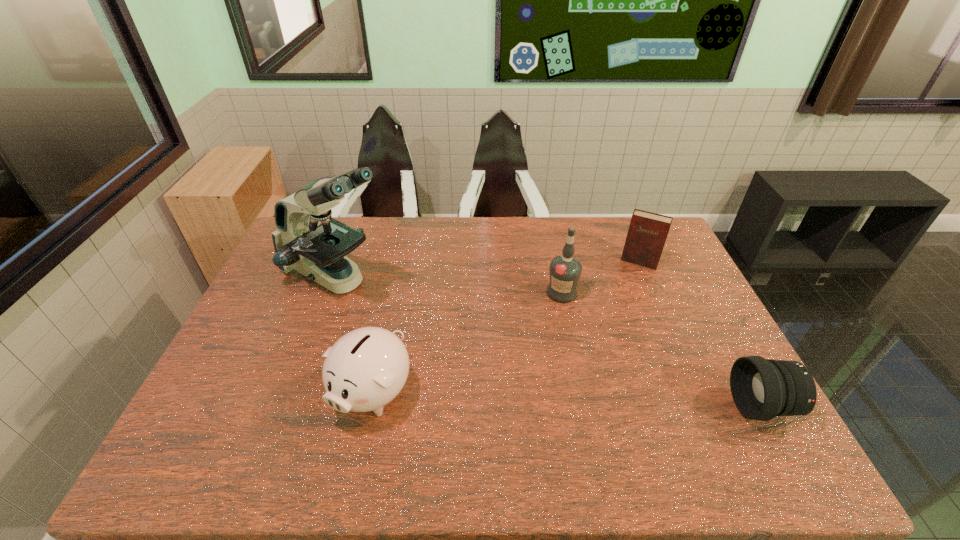
Where is `free location at the far edge of the desktop`? This screenshot has width=960, height=540. free location at the far edge of the desktop is located at coordinates (516, 241).

The image size is (960, 540). What are the coordinates of `vacant space at the near edge of the desktop` in the screenshot? It's located at (415, 427).

You are a GUI agent. You are given a task and a screenshot of the screen. Output one action in this format:
    pyautogui.click(x=<x>, y=<y>)
    Task: Click on the vacant space at the left edge of the desktop
    Image resolution: width=960 pixels, height=540 pixels.
    Given the screenshot: What is the action you would take?
    pyautogui.click(x=285, y=346)

Locate an element on the screen. The height and width of the screenshot is (540, 960). vacant space at the right edge of the desktop is located at coordinates (711, 362).

Locate an element on the screen. vacant space at the near left corner of the desktop is located at coordinates (197, 410).

The height and width of the screenshot is (540, 960). I want to click on free space at the near right corner of the desktop, so click(732, 416).

The height and width of the screenshot is (540, 960). I want to click on vacant point located between the diary and the rightmost object, so click(x=701, y=334).

Where is `vacant space that's between the vodka and the tallest object`? The image size is (960, 540). vacant space that's between the vodka and the tallest object is located at coordinates (449, 285).

At what (x,y) coordinates should I click in order to perform the action: click on free space between the second object from right to left and the microscope. Please return your answer as a coordinate pair (x, y). This screenshot has width=960, height=540. Looking at the image, I should click on (488, 270).

The image size is (960, 540). In order to click on vacant area that lies between the piggy bank and the second tallest object in this screenshot , I will do `click(468, 342)`.